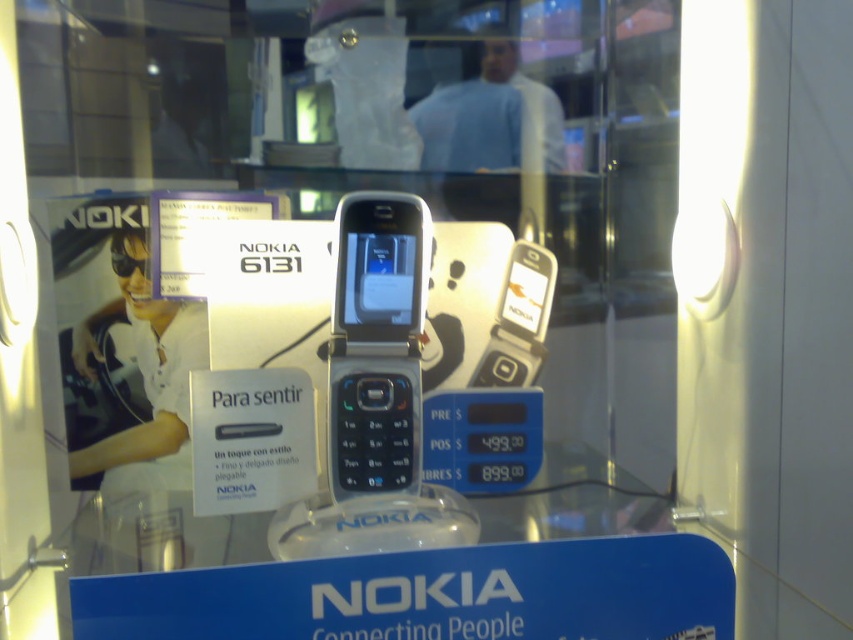
Question: Which object appears closest to the camera in this image?

Choices:
 (A) transparent glass table at center
 (B) silver metallic phone at center

Answer: (B)

Question: Which point appears closest to the camera in this image?

Choices:
 (A) (126, 544)
 (B) (48, 396)

Answer: (A)

Question: Is silver metallic phone at center behind transparent glass table at center?

Choices:
 (A) no
 (B) yes

Answer: (A)

Question: Is silver metallic phone at center bigger than transparent glass table at center?

Choices:
 (A) no
 (B) yes

Answer: (B)

Question: Is silver metallic phone at center to the left of transparent glass table at center from the viewer's perspective?

Choices:
 (A) yes
 (B) no

Answer: (A)